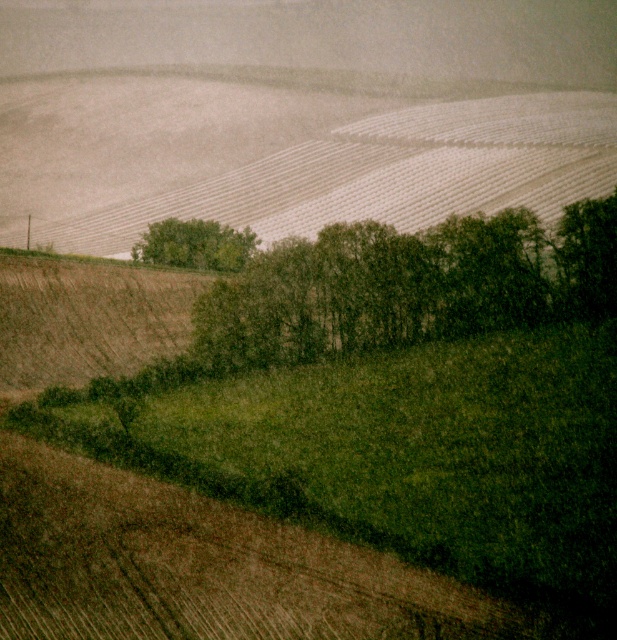
Question: Which point is farther to the camera?

Choices:
 (A) green leafy trees at center
 (B) green leafy tree at center

Answer: (B)

Question: Does green leafy trees at center appear over green leafy tree at center?

Choices:
 (A) yes
 (B) no

Answer: (B)

Question: Is green leafy trees at center bigger than green leafy tree at center?

Choices:
 (A) no
 (B) yes

Answer: (B)

Question: Which point is closer to the camera?

Choices:
 (A) green leafy tree at center
 (B) green leafy trees at center

Answer: (B)

Question: Can you confirm if green leafy trees at center is wider than green leafy tree at center?

Choices:
 (A) yes
 (B) no

Answer: (A)

Question: Which of the following is the closest to the observer?

Choices:
 (A) (178, 237)
 (B) (233, 323)

Answer: (B)